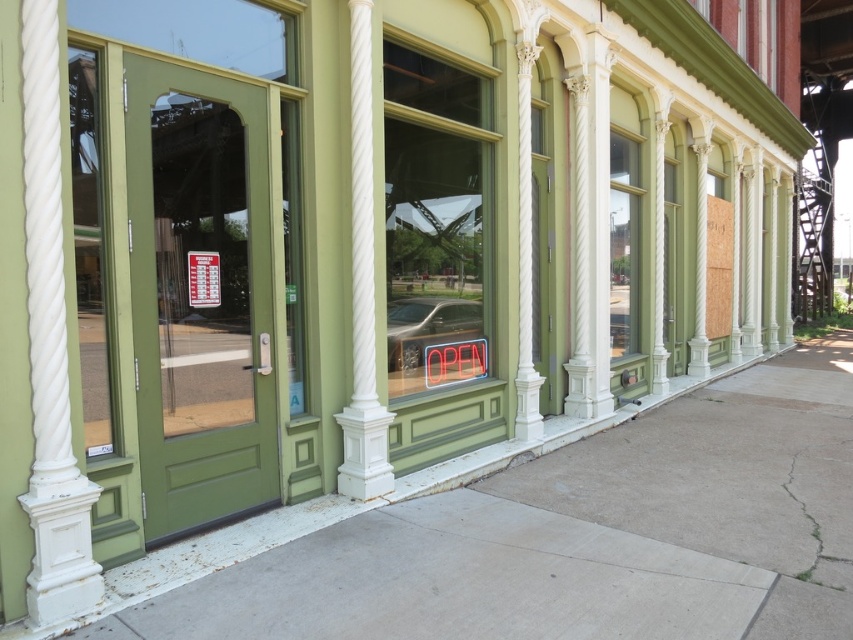
You are a delivery person standing on the sidewalk in front of the building. You need to hand over a package to the receptionist inside. The receptionist is standing behind the white textured column at center. To reach them, you have to look through the matte glass window at center. Which object is closer to you, the delivery person, when you are on the sidewalk?

The white textured column at center is closer to you because it is positioned below the matte glass window at center, meaning the column is nearer to the sidewalk level while the window is above it.

You are standing on the sidewalk in front of the building. You notice the white textured column at left and the green glass door at left. Which object is taller?

The white textured column at left is taller than the green glass door at left.

You are a delivery person approaching the building and need to deliver a package to the entrance. The entrance is the green glass door at left. However, you notice the white textured column at left might be blocking your path. Can you pass through the entrance without hitting the column?

The white textured column at left is larger in size than the green glass door at left, so there might be limited space between them. You should approach carefully to ensure you can pass through the entrance without hitting the column.